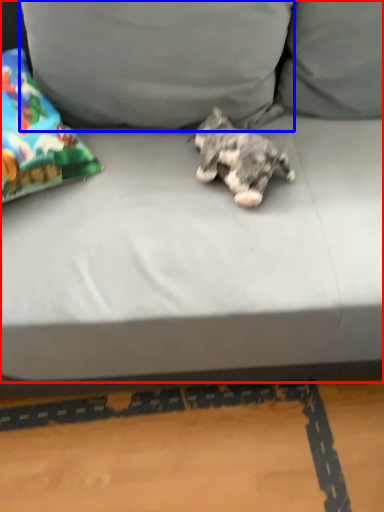
Question: Which object appears farthest to the camera in this image, studio couch (highlighted by a red box) or pillow (highlighted by a blue box)?

Choices:
 (A) studio couch
 (B) pillow

Answer: (B)